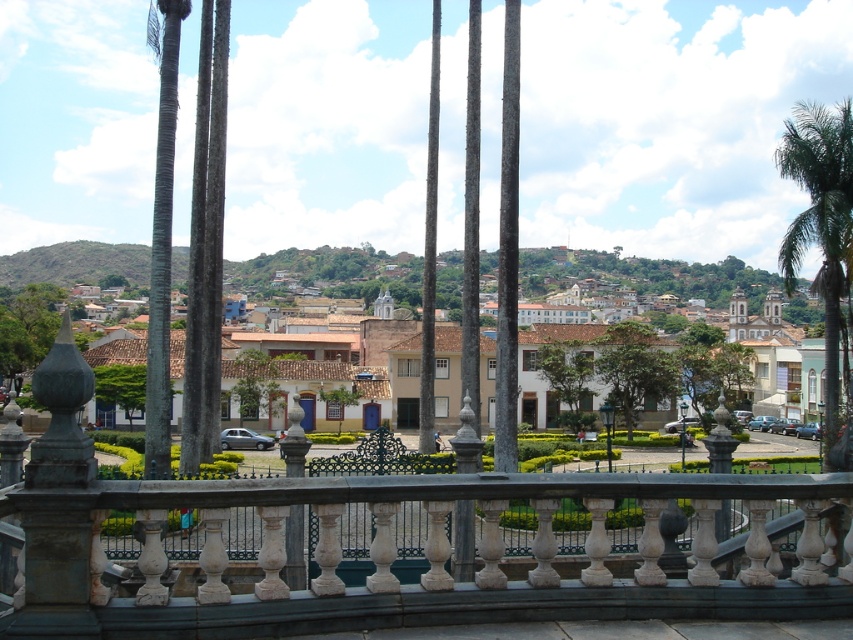
Question: Can you confirm if stone balustrade at center is smaller than white matte building at center?

Choices:
 (A) no
 (B) yes

Answer: (B)

Question: Based on their relative distances, which object is nearer to the green leafy palm tree at right?

Choices:
 (A) stone balustrade at center
 (B) white matte building at center

Answer: (A)

Question: Which object appears closest to the camera in this image?

Choices:
 (A) green leafy tree at center
 (B) white matte building at center

Answer: (A)

Question: Which point is farther to the camera?

Choices:
 (A) green leafy tree at center
 (B) green leafy palm tree at right
 (C) stone balustrade at center

Answer: (A)

Question: Can you confirm if green leafy palm tree at right is positioned to the left of green leafy tree at center?

Choices:
 (A) no
 (B) yes

Answer: (A)

Question: Where is green leafy palm tree at right located in relation to green leafy tree at center in the image?

Choices:
 (A) right
 (B) left

Answer: (A)